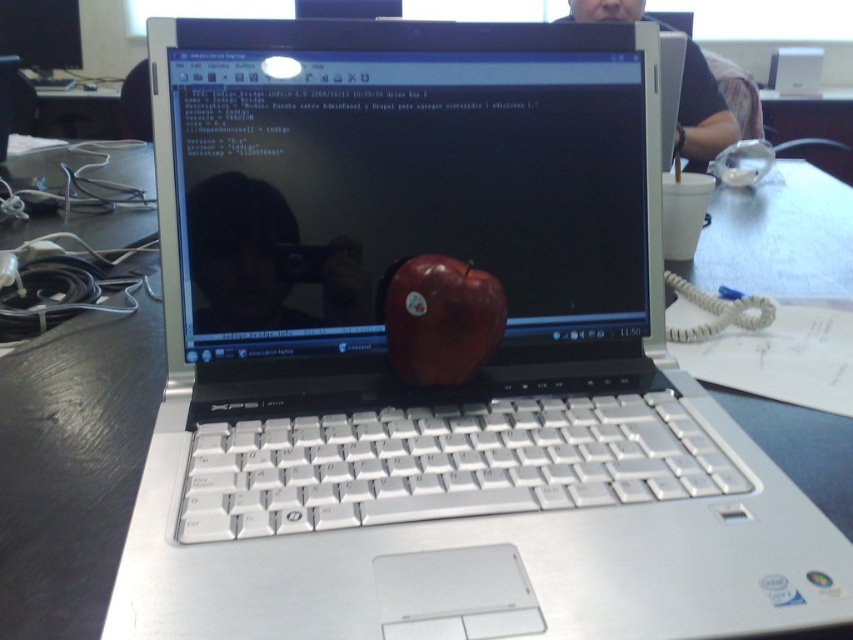
Question: Is glossy plastic computer screen at center closer to the viewer compared to matte black laptop at center?

Choices:
 (A) yes
 (B) no

Answer: (A)

Question: Can you confirm if glossy plastic computer screen at center is positioned above shiny red apple at center?

Choices:
 (A) yes
 (B) no

Answer: (A)

Question: Which point appears closest to the camera in this image?

Choices:
 (A) (335, 186)
 (B) (474, 328)
 (C) (686, 51)

Answer: (B)

Question: Which of the following is the farthest from the observer?

Choices:
 (A) (436, 232)
 (B) (703, 145)
 (C) (405, 371)

Answer: (B)

Question: Is glossy plastic computer screen at center to the left of shiny red apple at center from the viewer's perspective?

Choices:
 (A) no
 (B) yes

Answer: (A)

Question: Among these objects, which one is farthest from the camera?

Choices:
 (A) shiny red apple at center
 (B) glossy plastic computer screen at center
 (C) matte black laptop at center

Answer: (C)